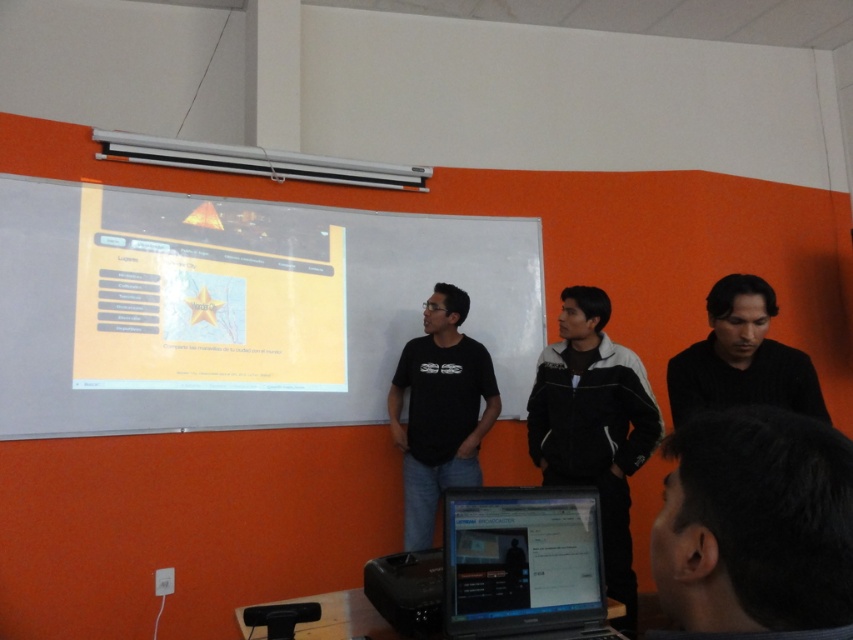
Question: Does black matte shirt at center appear on the right side of black plastic projector at lower center?

Choices:
 (A) no
 (B) yes

Answer: (B)

Question: Does dark gray hair at upper right have a lesser width compared to black plastic projector at lower center?

Choices:
 (A) no
 (B) yes

Answer: (B)

Question: Which object is farther from the camera taking this photo?

Choices:
 (A) black sweater at right
 (B) matte white projector screen at upper center
 (C) black matte shirt at center

Answer: (C)

Question: Can you confirm if matte white projector screen at upper center is positioned above dark gray hair at upper right?

Choices:
 (A) yes
 (B) no

Answer: (A)

Question: Which point appears closest to the camera in this image?

Choices:
 (A) (247, 301)
 (B) (508, 493)

Answer: (B)

Question: Which point is farther from the camera taking this photo?

Choices:
 (A) (793, 371)
 (B) (434, 502)
 (C) (755, 557)
 (D) (485, 337)

Answer: (D)